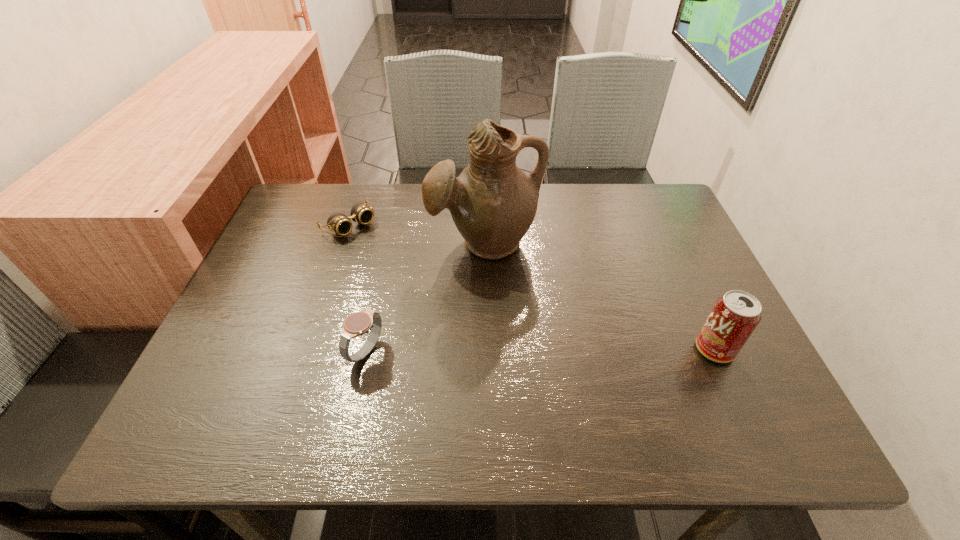
Image resolution: width=960 pixels, height=540 pixels. Find the location of `vacant space on the desktop that is between the third object from right to left and the rightmost object and is positioned at the spout of the tallest object`. vacant space on the desktop that is between the third object from right to left and the rightmost object and is positioned at the spout of the tallest object is located at coordinates (491, 351).

At what (x,y) coordinates should I click in order to perform the action: click on free space on the desktop that is between the watch and the second tallest object and is positioned through the lenses of the leftmost object. Please return your answer as a coordinate pair (x, y). The width and height of the screenshot is (960, 540). Looking at the image, I should click on (503, 351).